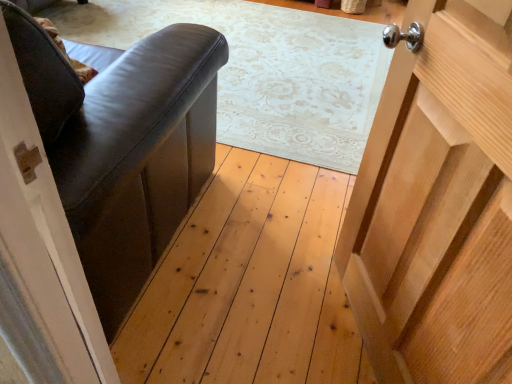
Question: Can you confirm if matte black leather armchair at left is thinner than wooden door at right?

Choices:
 (A) no
 (B) yes

Answer: (A)

Question: Is matte black leather armchair at left wider than wooden door at right?

Choices:
 (A) yes
 (B) no

Answer: (A)

Question: Is matte black leather armchair at left behind wooden door at right?

Choices:
 (A) yes
 (B) no

Answer: (A)

Question: From a real-world perspective, is matte black leather armchair at left under wooden door at right?

Choices:
 (A) yes
 (B) no

Answer: (A)

Question: Can you confirm if matte black leather armchair at left is bigger than wooden door at right?

Choices:
 (A) no
 (B) yes

Answer: (B)

Question: Is matte black leather armchair at left facing towards wooden door at right?

Choices:
 (A) yes
 (B) no

Answer: (B)

Question: Is the depth of wooden door at right greater than that of matte black leather armchair at left?

Choices:
 (A) yes
 (B) no

Answer: (B)

Question: Is the position of wooden door at right less distant than that of matte black leather armchair at left?

Choices:
 (A) no
 (B) yes

Answer: (B)

Question: Is wooden door at right at the right side of matte black leather armchair at left?

Choices:
 (A) yes
 (B) no

Answer: (A)

Question: From a real-world perspective, is wooden door at right under matte black leather armchair at left?

Choices:
 (A) yes
 (B) no

Answer: (B)

Question: Considering the relative positions of wooden door at right and matte black leather armchair at left in the image provided, is wooden door at right to the left of matte black leather armchair at left from the viewer's perspective?

Choices:
 (A) no
 (B) yes

Answer: (A)

Question: From a real-world perspective, is wooden door at right on top of matte black leather armchair at left?

Choices:
 (A) yes
 (B) no

Answer: (A)

Question: Considering the positions of matte black leather armchair at left and wooden door at right in the image, is matte black leather armchair at left taller or shorter than wooden door at right?

Choices:
 (A) tall
 (B) short

Answer: (B)